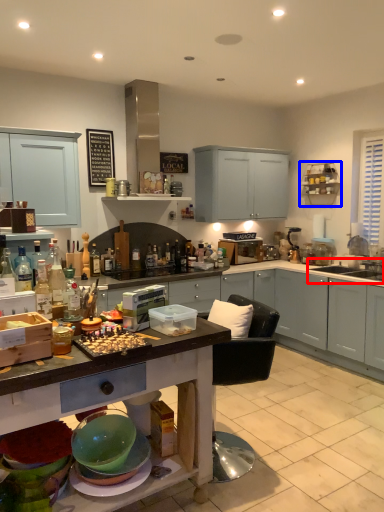
Question: Which point is closer to the camera, sink (highlighted by a red box) or cabinet (highlighted by a blue box)?

Choices:
 (A) sink
 (B) cabinet

Answer: (A)